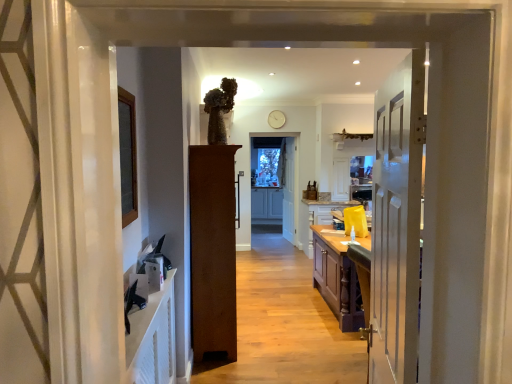
Question: In the image, is yellow matte cabinet at center, placed as the second cabinetry when sorted from back to front, on the left side or the right side of white painted wood door at right, which appears as the 1th door when viewed from the front?

Choices:
 (A) right
 (B) left

Answer: (A)

Question: Is yellow matte cabinet at center, marked as the first cabinetry in a front-to-back arrangement, inside or outside of white painted wood door at right, marked as the second door in a left-to-right arrangement?

Choices:
 (A) outside
 (B) inside

Answer: (A)

Question: Considering the real-world distances, which object is farthest from the wooden floor at center?

Choices:
 (A) white painted wood door at right, which ranks as the 2th door in right-to-left order
 (B) white glossy cabinet at center
 (C) brown wood cabinet at center, which appears as the first door when viewed from the left
 (D) matte gray cabinetry at center, which is counted as the first cabinetry, starting from the left
 (E) white wooden door at center, the third door in the left-to-right sequence

Answer: (D)

Question: Which object is positioned farthest from the wooden floor at center?

Choices:
 (A) white glossy cabinet at center
 (B) white wooden door at center, marked as the 1th door in a back-to-front arrangement
 (C) brown wood cabinet at center, the second door when ordered from front to back
 (D) yellow matte cabinet at center, the first cabinetry viewed from the right
 (E) matte gray cabinetry at center, acting as the second cabinetry starting from the front

Answer: (E)